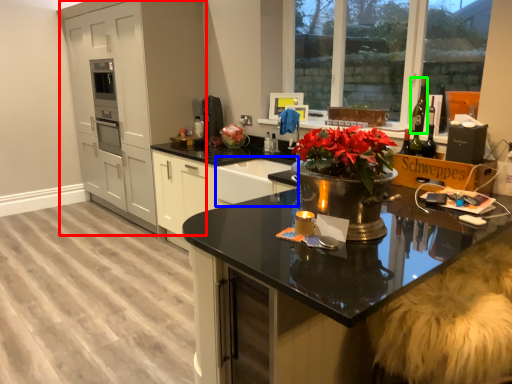
Question: Considering the real-world distances, which object is farthest from cabinetry (highlighted by a red box)? sink (highlighted by a blue box) or wine bottle (highlighted by a green box)?

Choices:
 (A) sink
 (B) wine bottle

Answer: (B)